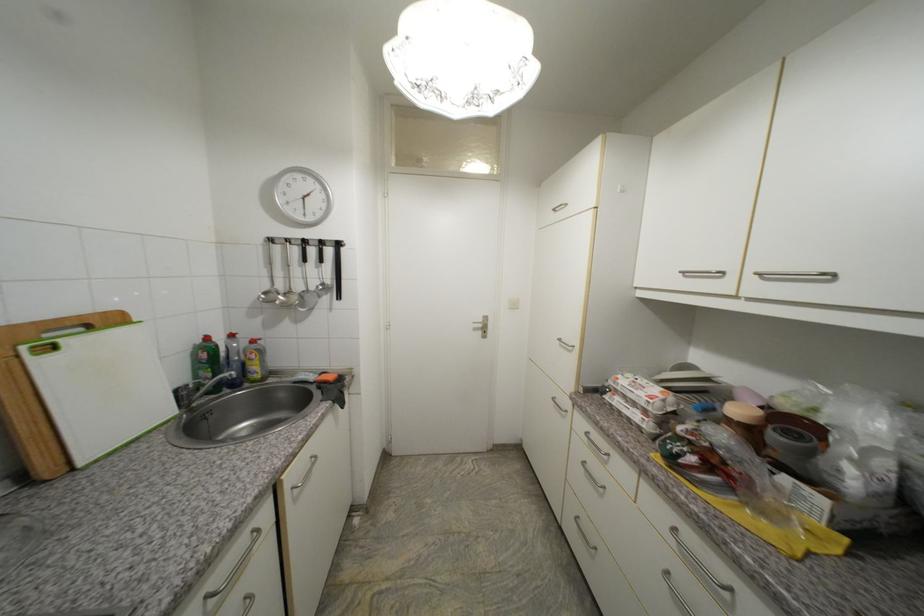
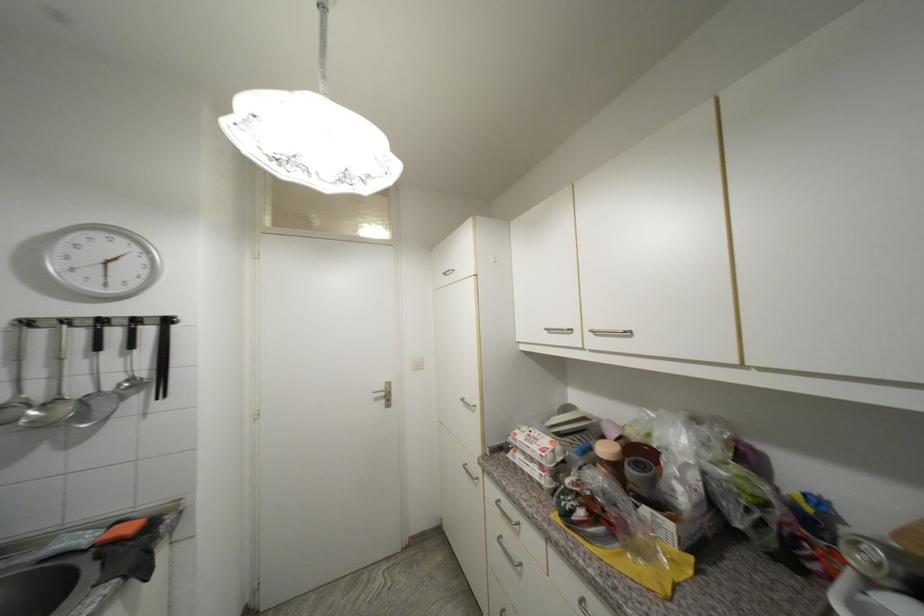
Locate, in the second image, the point that corresponds to point 756,432 in the first image.

(622, 469)